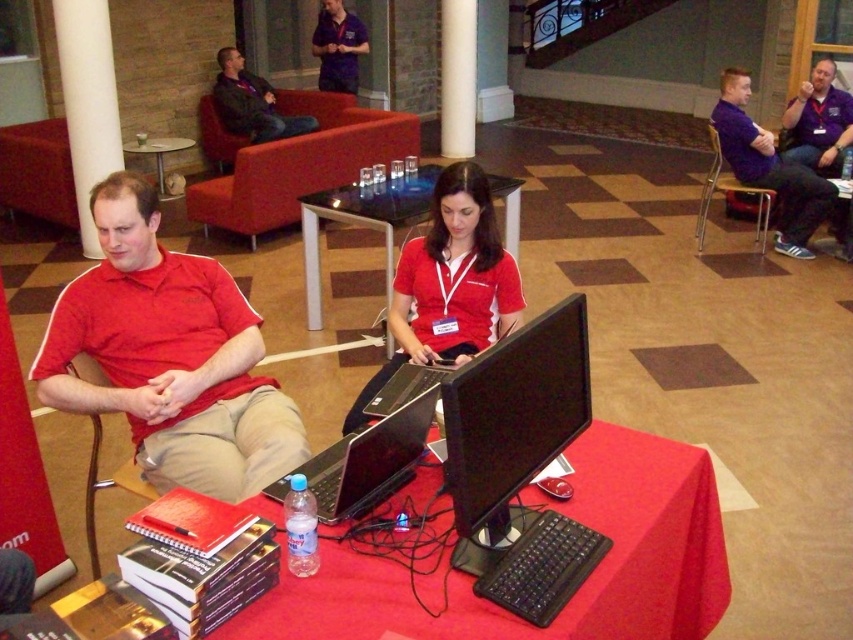
You are organizing a small event and need to determine which item takes up more area on the table. Which one is larger between the red cloth at center and the dark blue jacket at upper center?

The dark blue jacket at upper center occupies more space than the red cloth at center because the red cloth at center occupies less space than dark blue jacket at upper center.

You are standing in the lounge and want to place a 12 feet long banner on the floor. The banner needs to be placed along the length of the black glass table at center. Is the banner too long to fit along the table?

The black glass table at center is 11.79 feet from viewer. Since the banner is 12 feet long, it is slightly longer than the table, so it might not fit perfectly along the table.

You are a guest in this room and want to place your dark blue jacket at upper center on the red cloth at center. Is there enough space for the jacket?

The red cloth at center is positioned under dark blue jacket at upper center, so the jacket is already on the cloth. There is no need to place it again.